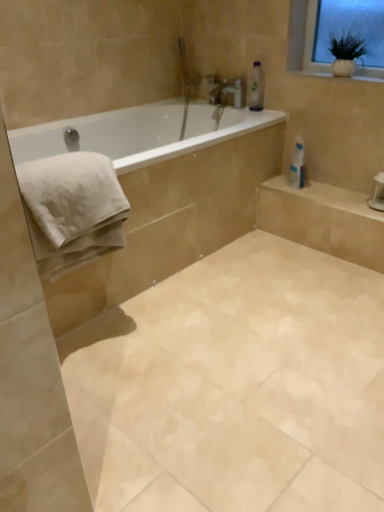
Question: Is point tap(324, 69) positioned closer to the camera than point tap(79, 251)?

Choices:
 (A) farther
 (B) closer

Answer: (A)

Question: Looking at their shapes, would you say white ceramic vase at upper right is wider or thinner than white cotton towel at left?

Choices:
 (A) thin
 (B) wide

Answer: (A)

Question: Which object is positioned farthest from the white matte towel at left?

Choices:
 (A) white glossy toilet paper at upper right
 (B) white cotton towel at left
 (C) white ceramic vase at upper right
 (D) beige marble tile at center
 (E) clear plastic bottle at upper center

Answer: (C)

Question: Which of these objects is positioned farthest from the clear plastic bottle at upper center?

Choices:
 (A) white ceramic vase at upper right
 (B) white matte towel at left
 (C) white cotton towel at left
 (D) beige marble tile at center
 (E) white glossy toilet paper at upper right

Answer: (D)